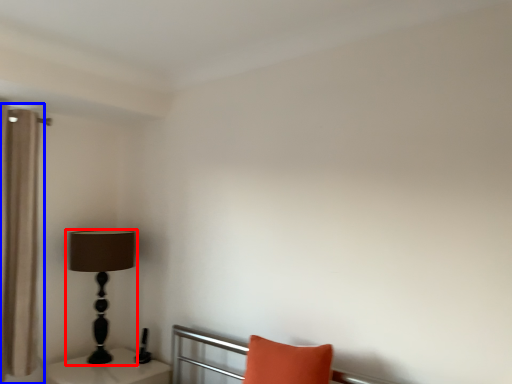
Question: Which object is closer to the camera taking this photo, lamp (highlighted by a red box) or curtain (highlighted by a blue box)?

Choices:
 (A) lamp
 (B) curtain

Answer: (B)